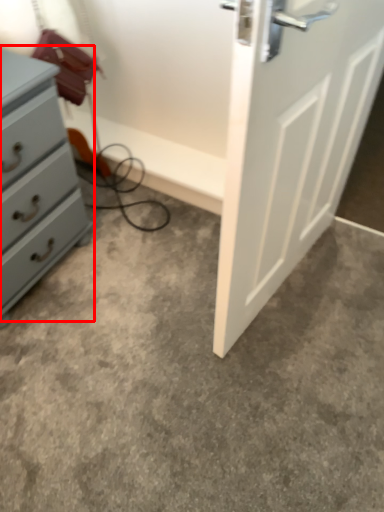
Question: From the image's perspective, where is chest of drawers (annotated by the red box) located relative to concrete?

Choices:
 (A) below
 (B) above

Answer: (B)